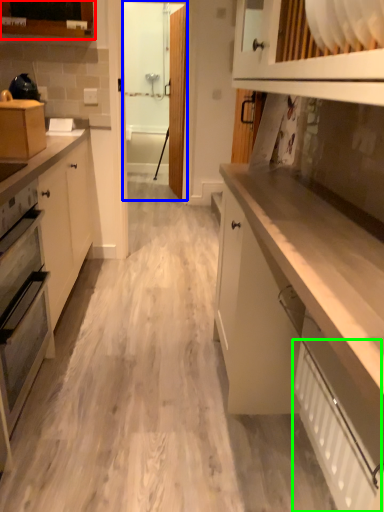
Question: Which is nearer to the cabinetry (highlighted by a red box)? glass door (highlighted by a blue box) or radiator (highlighted by a green box).

Choices:
 (A) glass door
 (B) radiator

Answer: (A)